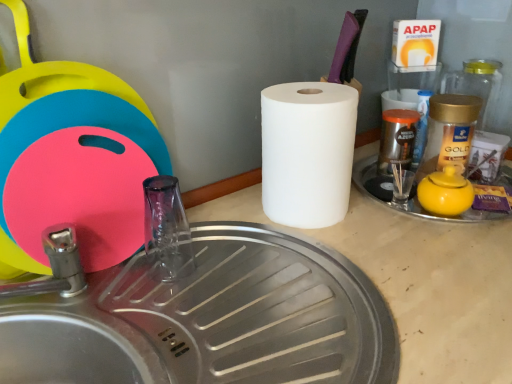
Question: Can you see transparent glass faucet at center touching brushed metal sink at lower left?

Choices:
 (A) no
 (B) yes

Answer: (A)

Question: Is transparent glass faucet at center shorter than brushed metal sink at lower left?

Choices:
 (A) yes
 (B) no

Answer: (A)

Question: Can we say transparent glass faucet at center lies outside brushed metal sink at lower left?

Choices:
 (A) no
 (B) yes

Answer: (B)

Question: Considering the relative sizes of transparent glass faucet at center and brushed metal sink at lower left in the image provided, is transparent glass faucet at center thinner than brushed metal sink at lower left?

Choices:
 (A) no
 (B) yes

Answer: (B)

Question: From the image's perspective, is transparent glass faucet at center above brushed metal sink at lower left?

Choices:
 (A) yes
 (B) no

Answer: (A)

Question: Considering the relative positions of transparent glass faucet at center and brushed metal sink at lower left in the image provided, is transparent glass faucet at center to the right of brushed metal sink at lower left from the viewer's perspective?

Choices:
 (A) no
 (B) yes

Answer: (A)

Question: Are brushed metal sink at lower left and white matte paper towel at center located far from each other?

Choices:
 (A) yes
 (B) no

Answer: (B)

Question: Considering the relative positions of brushed metal sink at lower left and white matte paper towel at center in the image provided, is brushed metal sink at lower left in front of white matte paper towel at center?

Choices:
 (A) no
 (B) yes

Answer: (B)

Question: From the image's perspective, does brushed metal sink at lower left appear lower than white matte paper towel at center?

Choices:
 (A) no
 (B) yes

Answer: (B)

Question: Is white matte paper towel at center inside brushed metal sink at lower left?

Choices:
 (A) yes
 (B) no

Answer: (B)

Question: Can you confirm if brushed metal sink at lower left is positioned to the left of white matte paper towel at center?

Choices:
 (A) yes
 (B) no

Answer: (A)

Question: Is brushed metal sink at lower left oriented away from white matte paper towel at center?

Choices:
 (A) yes
 (B) no

Answer: (B)

Question: From the image's perspective, is transparent glass faucet at center beneath yellow matte teapot at right?

Choices:
 (A) no
 (B) yes

Answer: (B)